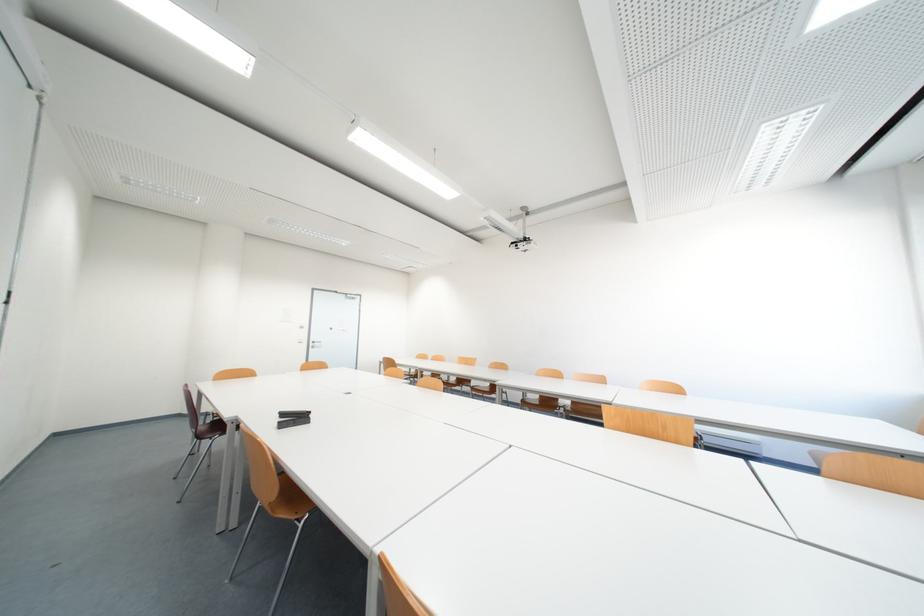
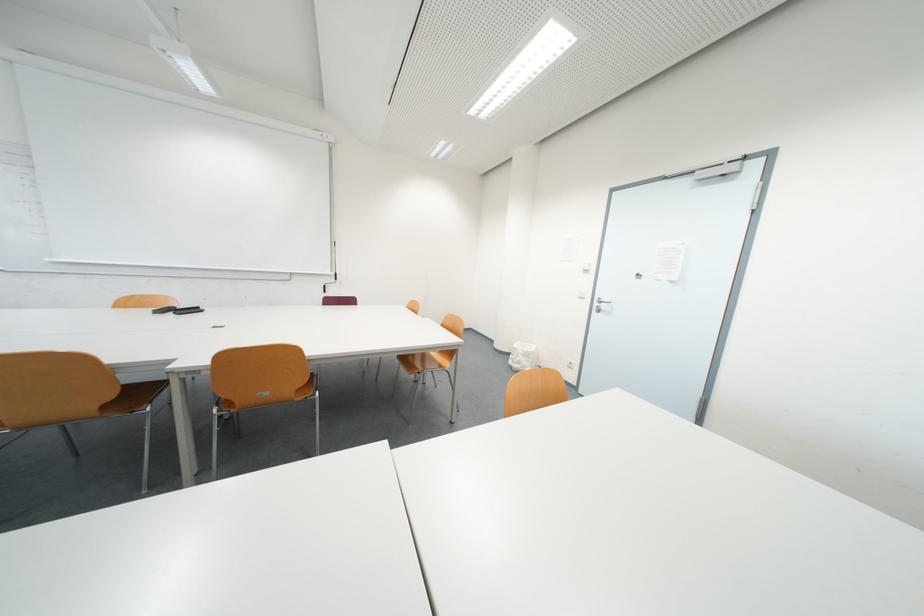
In the second image, find the point that corresponds to point (322, 345) in the first image.

(605, 305)